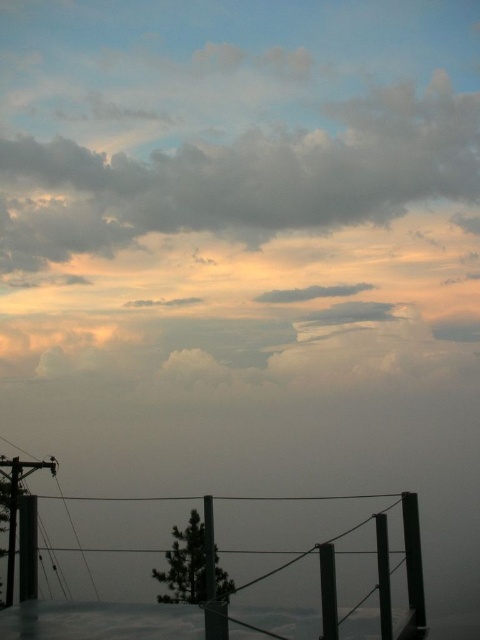
Can you confirm if cloudy sky at upper center is shorter than metallic gray telegraph pole at lower left?

Correct, cloudy sky at upper center is not as tall as metallic gray telegraph pole at lower left.

Measure the distance between cloudy sky at upper center and camera.

60.24 feet

Locate an element on the screen. This screenshot has width=480, height=640. cloudy sky at upper center is located at coordinates coord(240,179).

Is point (41, 211) positioned in front of point (327, 620)?

No, (41, 211) is behind (327, 620).

Between point (416, 188) and point (323, 593), which one is positioned in front?

Positioned in front is point (323, 593).

Is point (76, 243) positioned behind point (321, 564)?

Yes, it is behind point (321, 564).

Where is `cloudy sky at upper center`? The height and width of the screenshot is (640, 480). cloudy sky at upper center is located at coordinates (240, 179).

Looking at this image, between metallic gray telegraph pole at lower left and black matte pole at lower right, which one appears on the left side from the viewer's perspective?

metallic gray telegraph pole at lower left is more to the left.

Can you confirm if metallic gray telegraph pole at lower left is taller than black matte pole at lower right?

Yes.

Identify the location of metallic gray telegraph pole at lower left. (15, 508).

The image size is (480, 640). I want to click on metallic gray telegraph pole at lower left, so 15,508.